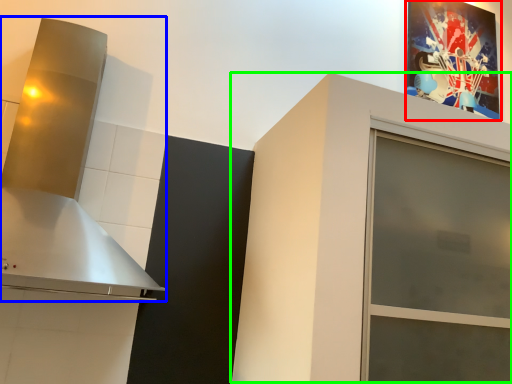
Question: Which object is the closest to the picture frame (highlighted by a red box)? Choose among these: vent (highlighted by a blue box) or cabinetry (highlighted by a green box).

Choices:
 (A) vent
 (B) cabinetry

Answer: (B)